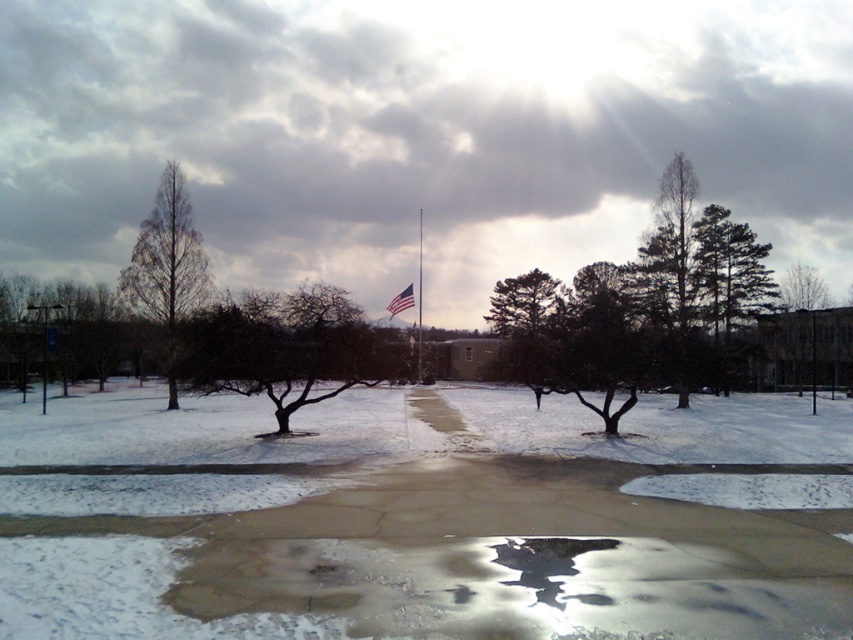
Question: Is white powdery snow at center in front of bare branches at center?

Choices:
 (A) yes
 (B) no

Answer: (A)

Question: Does white powdery snow at center appear under american flag at center?

Choices:
 (A) no
 (B) yes

Answer: (B)

Question: Considering the real-world distances, which object is closest to the dark green textured tree at center?

Choices:
 (A) polished metal flag pole at center
 (B) bare branches at center
 (C) white powdery snow at center
 (D) brown matte tree at center

Answer: (D)

Question: Does white powdery snow at center have a greater width compared to bare branches tree at left?

Choices:
 (A) no
 (B) yes

Answer: (B)

Question: Among these points, which one is nearest to the camera?

Choices:
 (A) (541, 310)
 (B) (656, 552)

Answer: (B)

Question: Which of the following is the closest to the observer?

Choices:
 (A) (399, 298)
 (B) (171, 243)

Answer: (B)